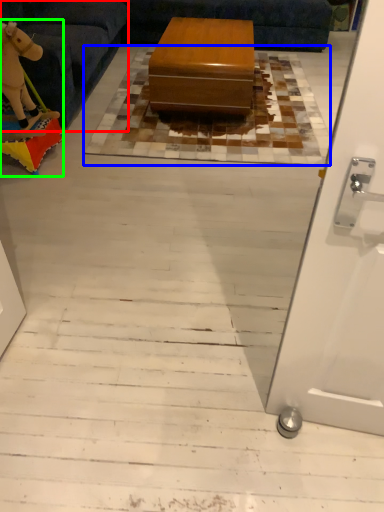
Question: Which object is positioned farthest from furniture (highlighted by a red box)? Select from mat (highlighted by a blue box) and toy (highlighted by a green box).

Choices:
 (A) mat
 (B) toy

Answer: (A)